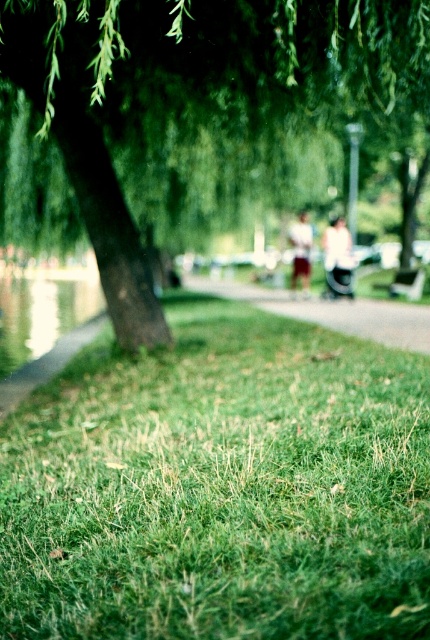
Can you confirm if green leafy tree at center is bigger than smooth asphalt path at center?

No, green leafy tree at center is not bigger than smooth asphalt path at center.

Does green leafy tree at center come in front of smooth asphalt path at center?

Yes, it is.

Image resolution: width=430 pixels, height=640 pixels. What are the coordinates of `green leafy tree at center` in the screenshot? It's located at pos(190,90).

Locate an element on the screen. This screenshot has width=430, height=640. green leafy tree at center is located at coordinates 190,90.

Is green grassy at lower center to the right of wooden park bench at center from the viewer's perspective?

Incorrect, green grassy at lower center is not on the right side of wooden park bench at center.

Describe the element at coordinates (221, 486) in the screenshot. I see `green grassy at lower center` at that location.

Between point (272, 509) and point (412, 284), which one is positioned behind?

Positioned behind is point (412, 284).

Image resolution: width=430 pixels, height=640 pixels. Identify the location of green grassy at lower center. (221, 486).

Describe the element at coordinates (42, 314) in the screenshot. The image size is (430, 640). I see `clear glass water at lower left` at that location.

Who is taller, clear glass water at lower left or wooden park bench at center?

With more height is clear glass water at lower left.

Is point (76, 316) closer to viewer compared to point (402, 282)?

No, it is behind (402, 282).

Image resolution: width=430 pixels, height=640 pixels. Find the location of `clear glass water at lower left`. clear glass water at lower left is located at coordinates (42, 314).